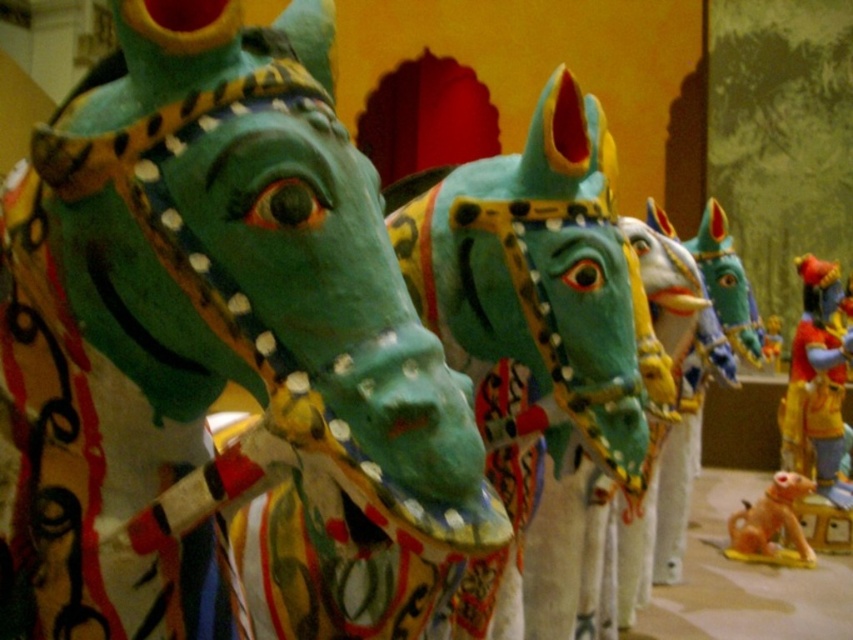
You are an art curator standing in front of the vibrant display of horse sculptures. You need to place a new sculpture exactly at the center of the exhibit. The current exhibit has a matte green horse at center. Where should you place the new sculpture to ensure it is centered?

The matte green horse at center is already positioned at the center point of the exhibit, so placing the new sculpture at the same location would ensure it is centered.

You are standing in front of the vibrant display of horse sculptures. There is a point marked at coordinates (204, 330). What is located at this point?

The point at coordinates (204, 330) marks the location of the matte green horse at center.

You are an art curator standing in front of the exhibit. You need to move the shiny red and gold figure at right closer to the matte green horse at center. Which direction should you move it to ensure it comes toward the front of the display?

Since the matte green horse at center is closer to the viewer than the shiny red and gold figure at right, you should move the shiny red and gold figure at right forward towards the matte green horse at center to bring it closer to the front of the display.